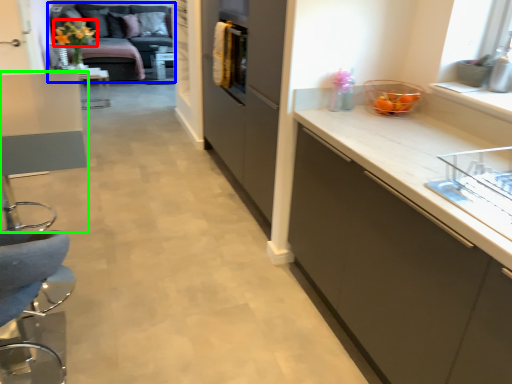
Question: Which is farther away from flower (highlighted by a red box)? studio couch (highlighted by a blue box) or table (highlighted by a green box)?

Choices:
 (A) studio couch
 (B) table

Answer: (B)